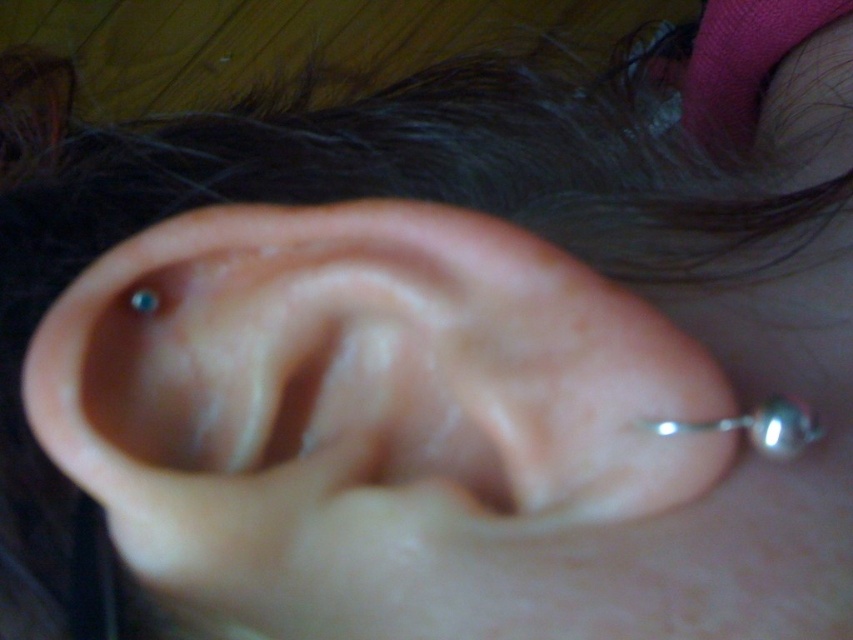
You are a photographer adjusting the focus on a closeup of an ear with two piercings. You notice two points labeled as point 1 and point 2. If point 1 is at position point (173, 289) and point 2 is at point (152, 314), which point is closer to the camera?

Point 2 at point (152, 314) is closer to the camera because point 1 at point (173, 289) is behind it.